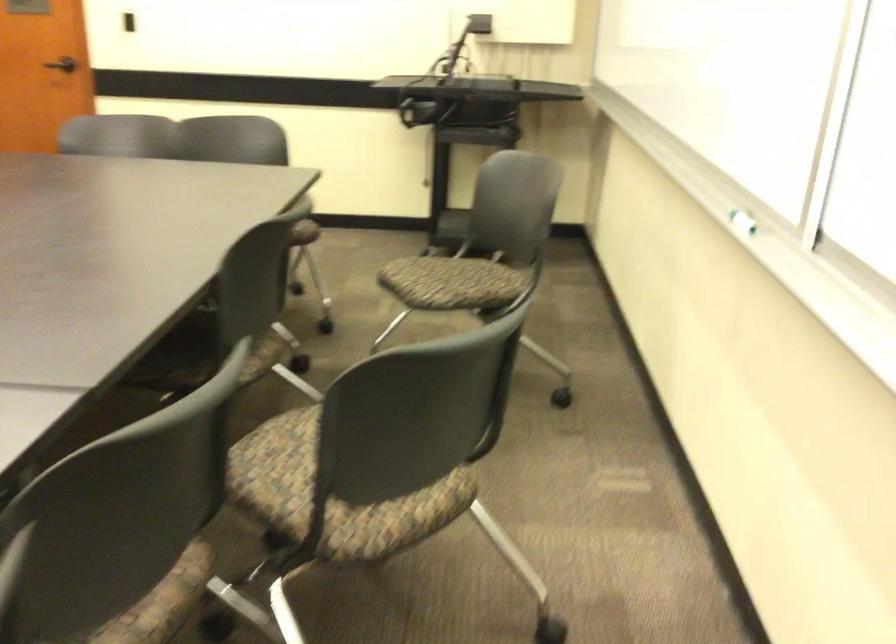
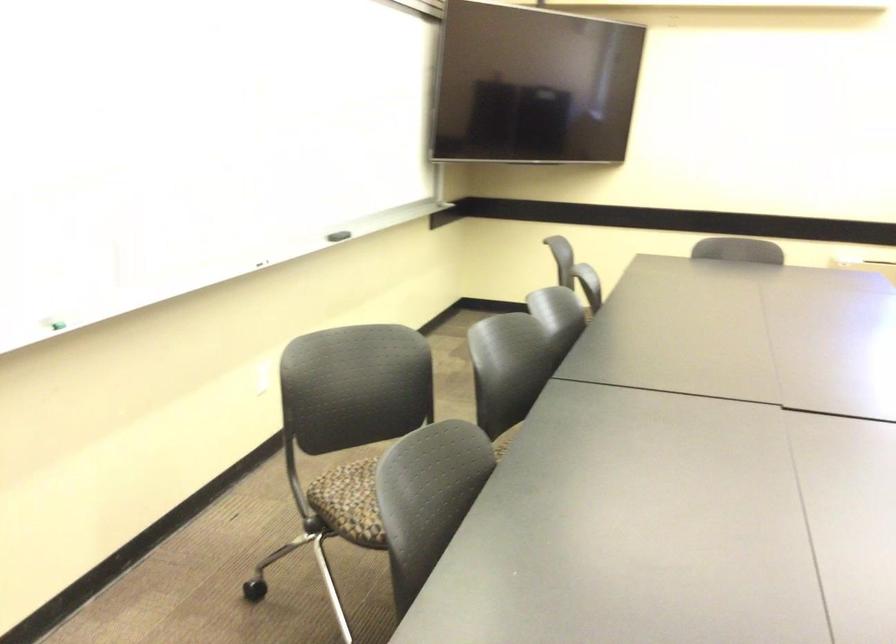
In the second image, find the point that corresponds to pixel 719 257 in the first image.

(55, 325)